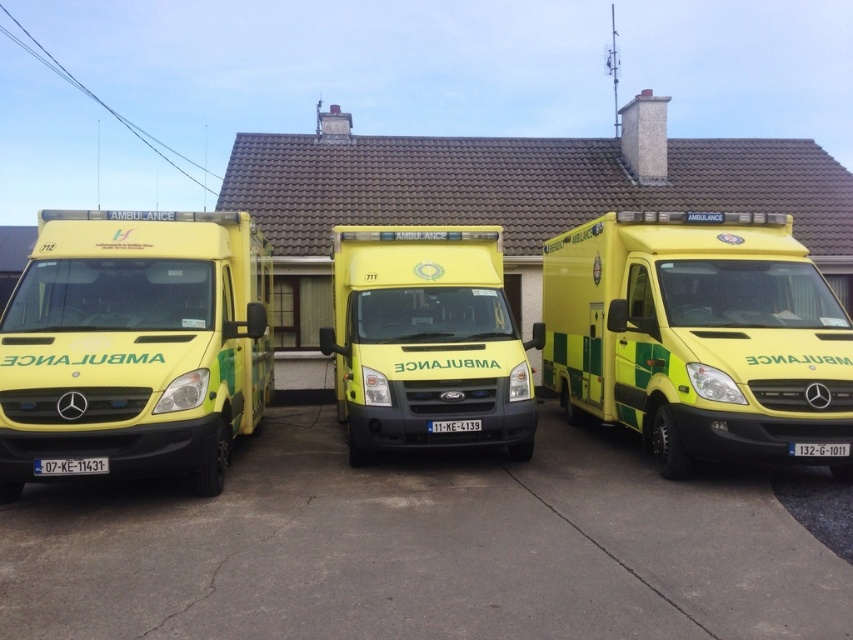
Question: Which is nearer to the yellow/green striped ambulance at center?

Choices:
 (A) yellow matte ambulance at left
 (B) yellow matte ambulance at center

Answer: (B)

Question: Which object appears closest to the camera in this image?

Choices:
 (A) yellow/green striped ambulance at center
 (B) yellow matte ambulance at center
 (C) yellow matte ambulance at left

Answer: (A)

Question: Does yellow matte ambulance at left appear on the right side of yellow matte ambulance at center?

Choices:
 (A) no
 (B) yes

Answer: (A)

Question: Can you confirm if yellow/green striped ambulance at center is positioned to the right of yellow matte ambulance at left?

Choices:
 (A) no
 (B) yes

Answer: (B)

Question: Among these points, which one is farthest from the camera?

Choices:
 (A) (96, 266)
 (B) (618, 356)

Answer: (B)

Question: Does yellow/green striped ambulance at center lie in front of yellow matte ambulance at center?

Choices:
 (A) yes
 (B) no

Answer: (A)